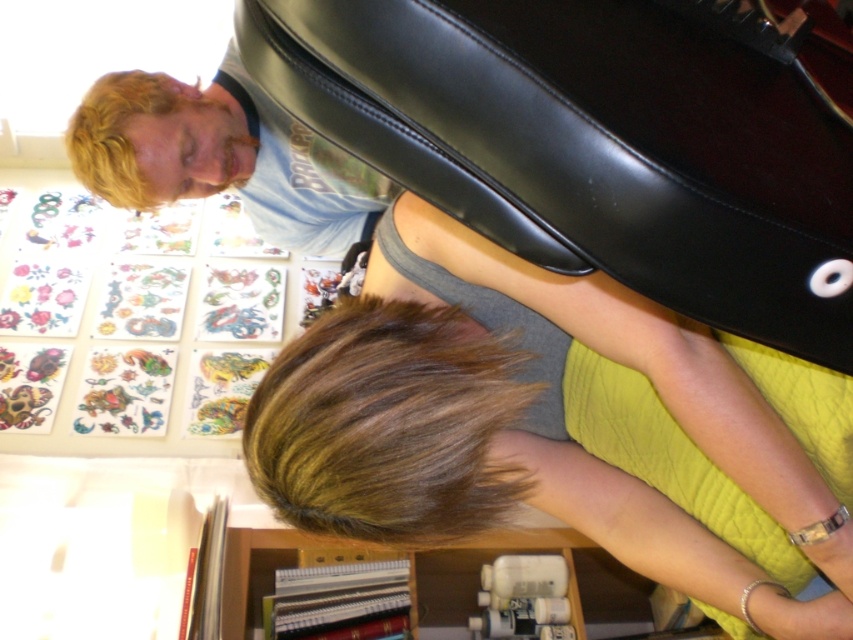
Question: Can you confirm if matte gray tank top at center is smaller than brown shiny hair at lower center?

Choices:
 (A) yes
 (B) no

Answer: (B)

Question: Considering the relative positions of matte gray tank top at center and brown shiny hair at lower center in the image provided, where is matte gray tank top at center located with respect to brown shiny hair at lower center?

Choices:
 (A) right
 (B) left

Answer: (A)

Question: Is matte gray tank top at center below brown shiny hair at lower center?

Choices:
 (A) yes
 (B) no

Answer: (A)